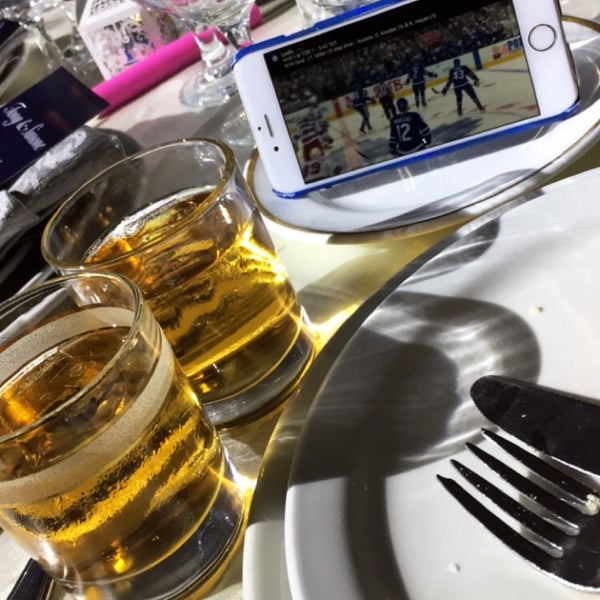
Where is `fork`? The height and width of the screenshot is (600, 600). fork is located at coordinates (536, 526).